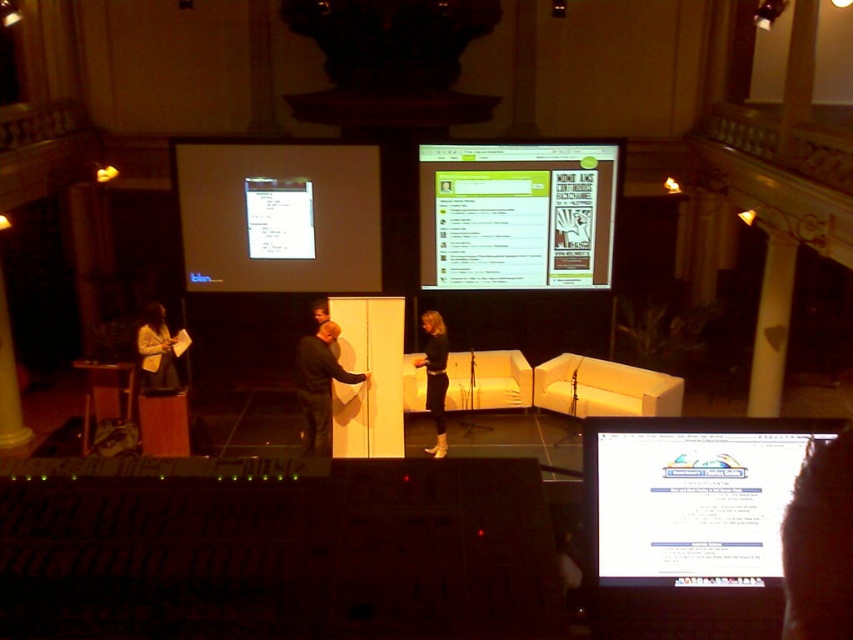
Question: Which point appears closest to the camera in this image?

Choices:
 (A) (701, 433)
 (B) (431, 340)

Answer: (A)

Question: Considering the real-world distances, which object is closest to the dark gray fabric jacket at center?

Choices:
 (A) black leather pants at center
 (B) white matte projector screen at upper left
 (C) white glossy computer screen at center
 (D) green matte screen at upper center

Answer: (A)

Question: Considering the relative positions of black leather pants at center and light beige sweater at lower left in the image provided, where is black leather pants at center located with respect to light beige sweater at lower left?

Choices:
 (A) below
 (B) above

Answer: (A)

Question: Is white glossy computer screen at center smaller than light beige sweater at lower left?

Choices:
 (A) no
 (B) yes

Answer: (B)

Question: Does white matte projector screen at upper left have a greater width compared to green matte screen at upper center?

Choices:
 (A) yes
 (B) no

Answer: (A)

Question: Estimate the real-world distances between objects in this image. Which object is closer to the light beige sweater at lower left?

Choices:
 (A) black leather pants at center
 (B) white matte projector screen at upper left
 (C) dark gray fabric jacket at center
 (D) green matte screen at upper center

Answer: (B)